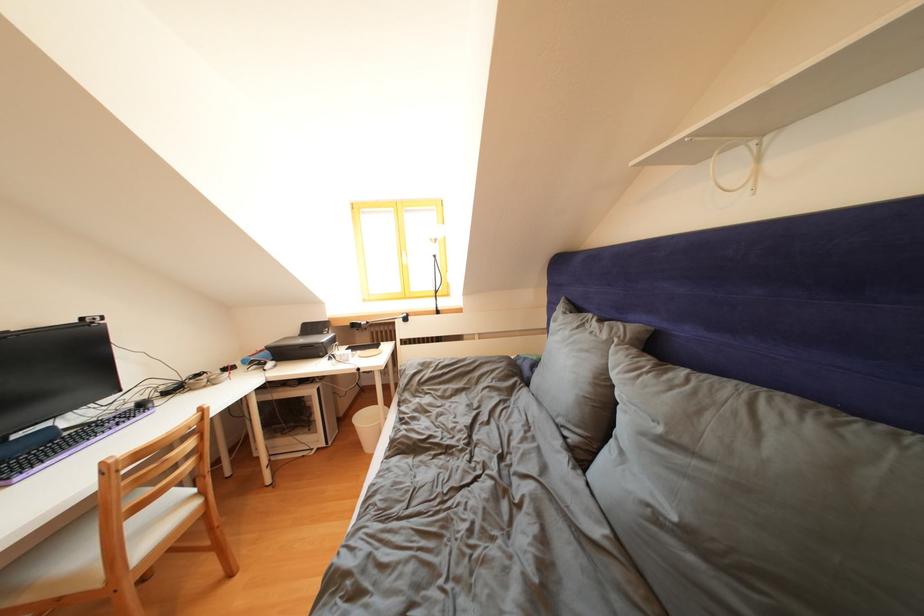
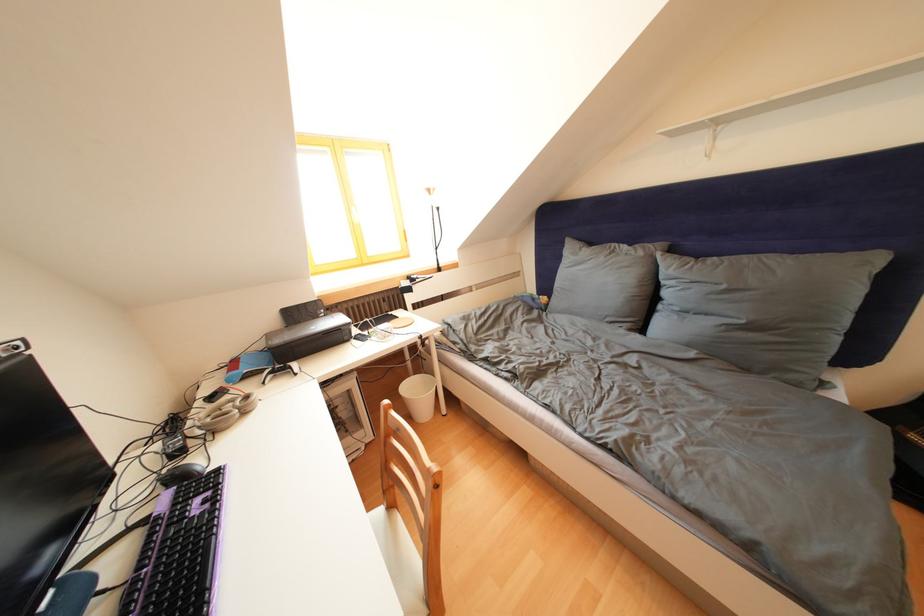
Locate, in the second image, the point that corresponds to [329,338] in the first image.

(323, 322)